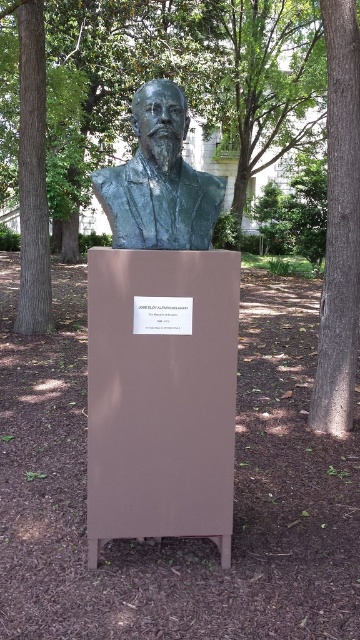
You are standing in a park and see two trees. One is a brown wood tree at center and the other is a brown textured tree at left. Which tree is closer to you?

The brown wood tree at center is closer to you because it is in front of the brown textured tree at left.

You are a visitor at an outdoor sculpture garden. You see a bronze bust at center and a smooth brown bark at right. Which object is higher in the image?

The smooth brown bark at right is above the bronze bust at center in the image.